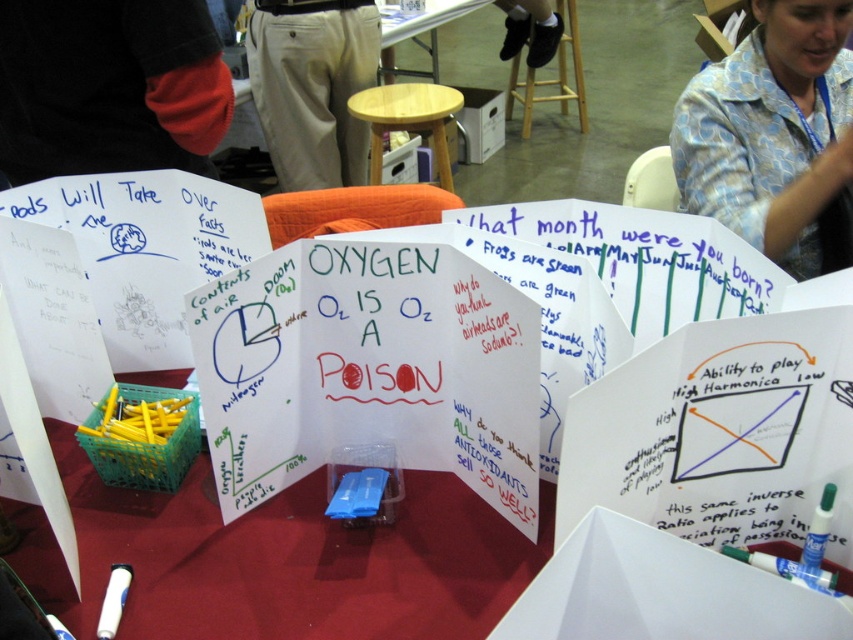
Looking at this image, you are a person who is 5 feet tall and wants to reach the top of the translucent plastic table at center. There is a beech wood stool at center nearby. Can you use the stool to reach the table?

The distance between the translucent plastic table at center and the beech wood stool at center is 6.81 feet. Since the stool is 6.81 feet away from the table, it would be too far to effectively use the stool to reach the table. You would need a closer stool or another method to reach the table.